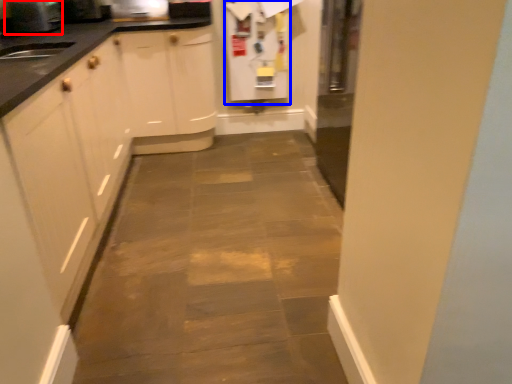
Question: Among these objects, which one is farthest to the camera, appliance (highlighted by a red box) or appliance (highlighted by a blue box)?

Choices:
 (A) appliance
 (B) appliance

Answer: (B)